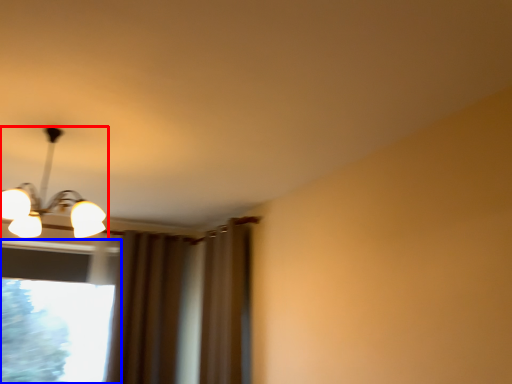
Question: Which of the following is the closest to the observer, lamp (highlighted by a red box) or window (highlighted by a blue box)?

Choices:
 (A) lamp
 (B) window

Answer: (A)